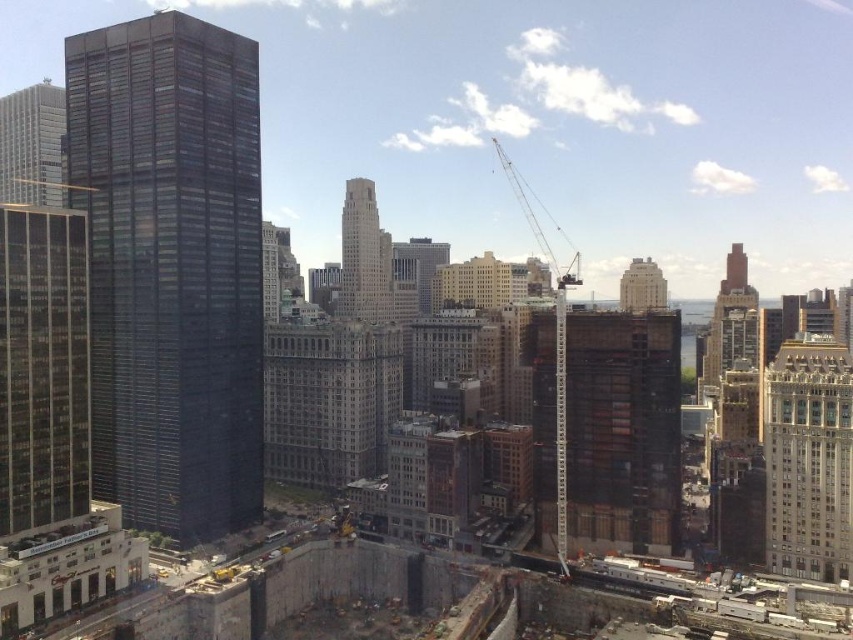
You are standing in the construction site and want to reach the dark brown wooden tower at center. Given that you can walk at a speed of 1.5 meters per second, how many seconds will it take you to reach the tower?

The dark brown wooden tower at center is 154.15 meters away from viewer. At a walking speed of 1.5 meters per second, it would take approximately 102.77 seconds to reach the tower.

You are a drone operator flying a drone that needs to land on the rooftop of the dark gray concrete building at upper center. However, there is a dark brown wooden tower at center in the way. Based on the scene, can you determine if the drone will have a clear path to land?

The dark brown wooden tower at center is closer to the viewer than the dark gray concrete building at upper center, so the drone will have a clear path to land on the rooftop of the dark gray concrete building at upper center because the tower is in front of it and not blocking the path.